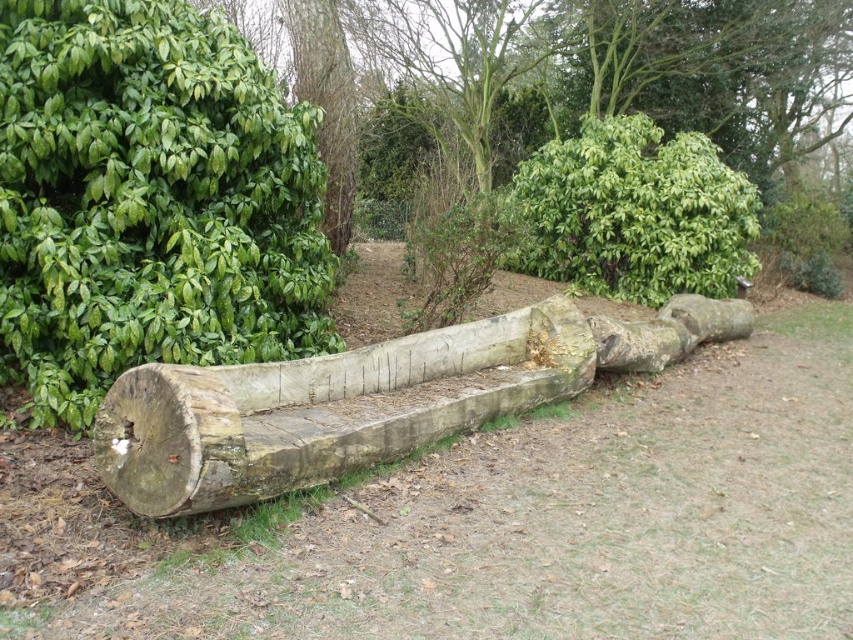
You are standing at point [149,200] in the image. What do you see immediately around you?

At point [149,200], there is a green leafy bush at left.

In the scene shown: You are standing at the center of the image and want to move towards the green leafy bush at left. Which direction should you face?

You should face the left direction to move towards the green leafy bush at left.